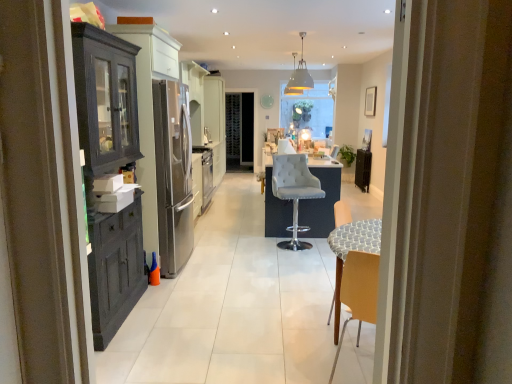
Locate an element on the screen. Image resolution: width=512 pixels, height=384 pixels. vacant region under gray fabric bar stool at center (from a real-world perspective) is located at coordinates (294, 244).